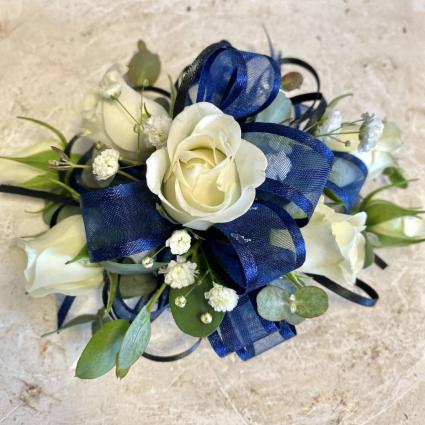
The image size is (425, 425). Identify the location of interesting floor design. (32, 394).